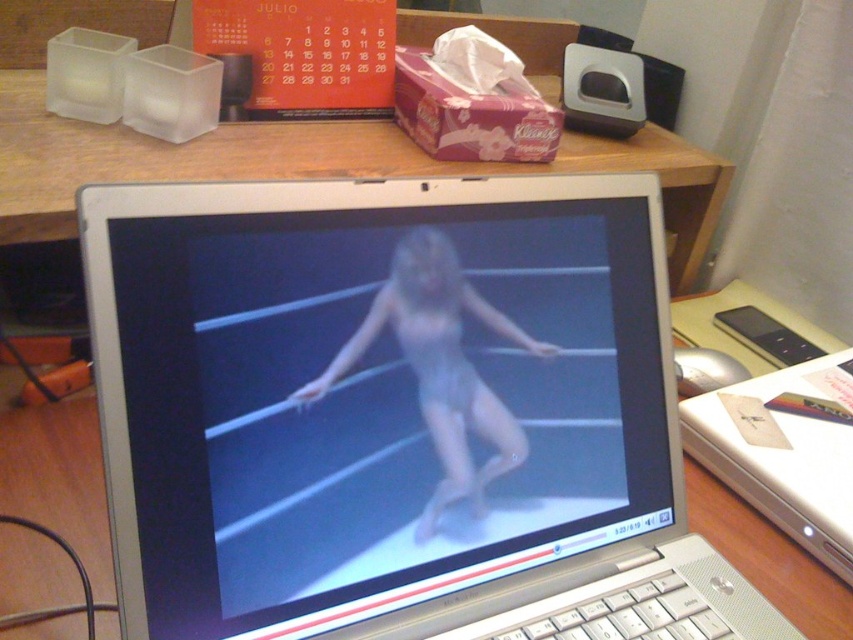
Is smooth skin woman at center shorter than white plastic mouse at right?

In fact, smooth skin woman at center may be taller than white plastic mouse at right.

Does smooth skin woman at center have a larger size compared to white plastic mouse at right?

Actually, smooth skin woman at center might be smaller than white plastic mouse at right.

Where is `smooth skin woman at center`? Image resolution: width=853 pixels, height=640 pixels. smooth skin woman at center is located at coordinates tap(439, 365).

Identify the location of smooth skin woman at center. (439, 365).

Who is more distant from viewer, (x=357, y=198) or (x=440, y=248)?

The point (x=440, y=248) is behind.

Is point (131, 298) farther from camera compared to point (431, 296)?

No, it is in front of (431, 296).

Which is in front, point (273, 500) or point (445, 477)?

Point (273, 500) is more forward.

Locate an element on the screen. Image resolution: width=853 pixels, height=640 pixels. silver metallic laptop at center is located at coordinates (396, 413).

Can you confirm if silver metallic laptop at center is wider than white plastic mouse at right?

Yes, silver metallic laptop at center is wider than white plastic mouse at right.

Who is more forward, (413,618) or (798,474)?

Positioned in front is point (413,618).

Is point (320, 625) positioned before point (730, 465)?

Yes, it is in front of point (730, 465).

You are a GUI agent. You are given a task and a screenshot of the screen. Output one action in this format:
    pyautogui.click(x=<x>, y=<y>)
    Task: Click on the silver metallic laptop at center
    The image size is (853, 640).
    Given the screenshot: What is the action you would take?
    [396, 413]